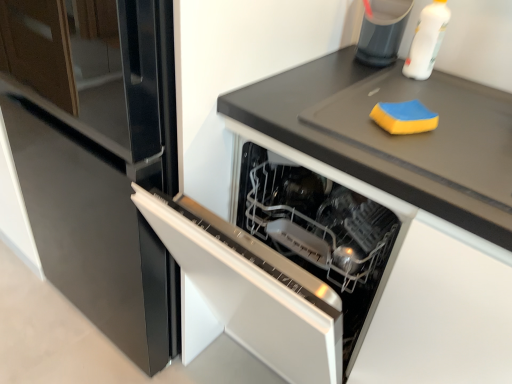
Locate an element on the screen. vacant area that is in front of white plastic bottle at upper right is located at coordinates (434, 94).